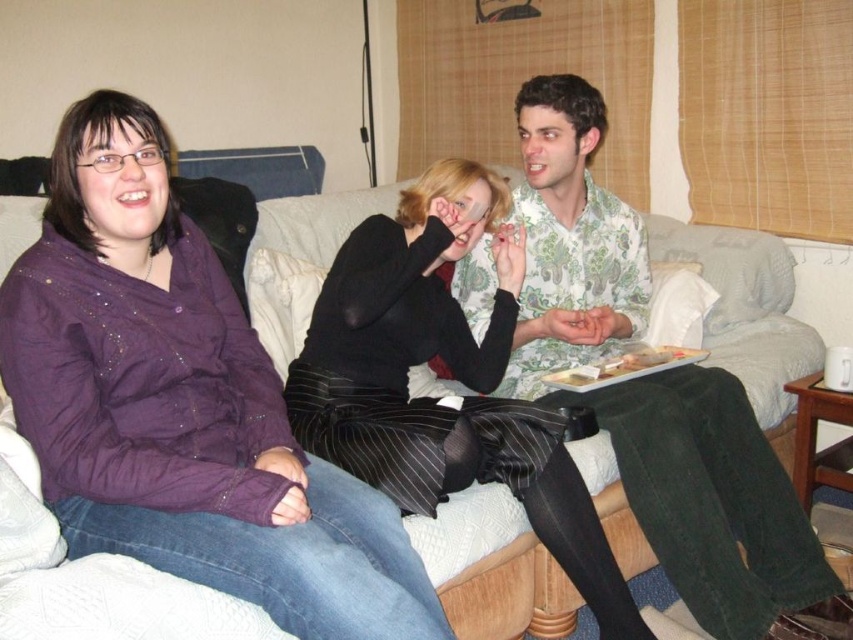
Question: Can you confirm if floral cotton shirt at center is positioned to the left of black pinstripe pants at center?

Choices:
 (A) no
 (B) yes

Answer: (A)

Question: Which object is positioned farthest from the floral cotton shirt at center?

Choices:
 (A) white fabric couch at upper left
 (B) black pinstripe pants at center

Answer: (A)

Question: From the image, what is the correct spatial relationship of floral cotton shirt at center in relation to black pinstripe pants at center?

Choices:
 (A) right
 (B) left

Answer: (A)

Question: Is black pinstripe pants at center below white fabric couch at upper left?

Choices:
 (A) no
 (B) yes

Answer: (B)

Question: Which point is closer to the camera?

Choices:
 (A) (685, 518)
 (B) (387, 364)
 (C) (279, 236)

Answer: (A)

Question: Among these points, which one is farthest from the camera?

Choices:
 (A) 834,625
 (B) 579,548
 (C) 770,314

Answer: (C)